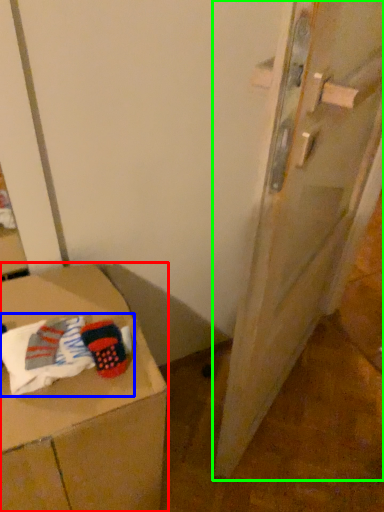
Question: Which object is positioned farthest from furniture (highlighted by a red box)? Select from laundry (highlighted by a blue box) and door (highlighted by a green box).

Choices:
 (A) laundry
 (B) door

Answer: (B)